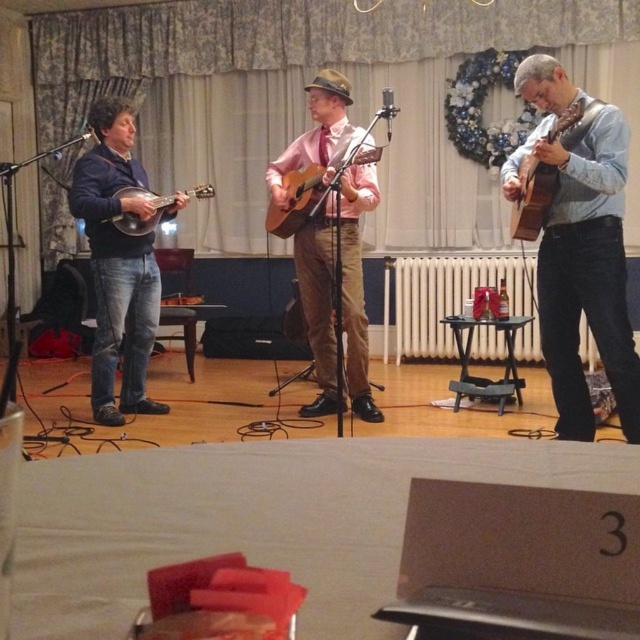
Question: Is matte brown guitar at center below matte black mandolin at left?

Choices:
 (A) yes
 (B) no

Answer: (A)

Question: Is matte black mandolin at left smaller than brown wooden guitar at right?

Choices:
 (A) yes
 (B) no

Answer: (B)

Question: Does brown wooden guitar at right lie behind matte wood mandolin at left?

Choices:
 (A) no
 (B) yes

Answer: (A)

Question: Considering the real-world distances, which object is farthest from the matte wood mandolin at left?

Choices:
 (A) matte black mandolin at left
 (B) matte pink shirt at center
 (C) acoustic wood guitar at center

Answer: (B)

Question: Considering the real-world distances, which object is closest to the brown wooden guitar at right?

Choices:
 (A) acoustic wood guitar at center
 (B) matte black mandolin at left
 (C) matte brown guitar at center

Answer: (C)

Question: Which of the following is the closest to the observer?

Choices:
 (A) coord(202,196)
 (B) coord(304,196)

Answer: (B)